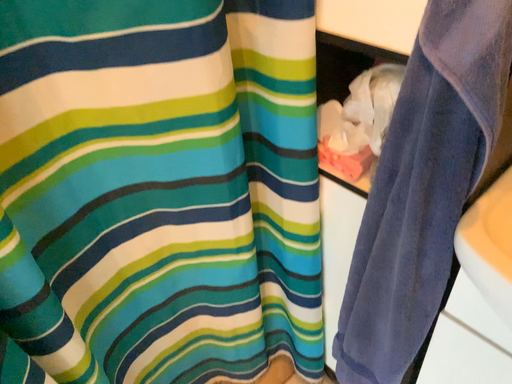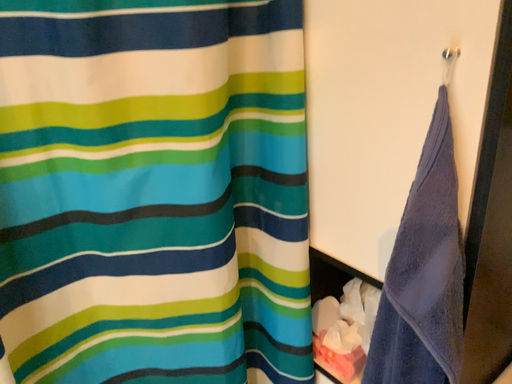
Question: Which way did the camera rotate in the video?

Choices:
 (A) rotated upward
 (B) rotated downward

Answer: (A)